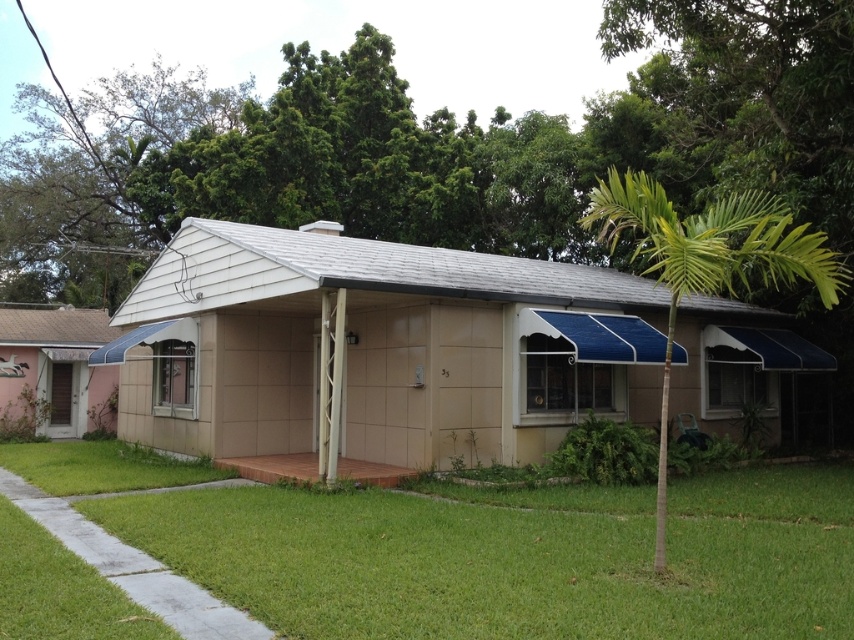
Which is above, beige tile shed at center or green grass at lower center?

Positioned higher is beige tile shed at center.

This screenshot has height=640, width=854. What do you see at coordinates (375, 349) in the screenshot? I see `beige tile shed at center` at bounding box center [375, 349].

Locate an element on the screen. beige tile shed at center is located at coordinates (375, 349).